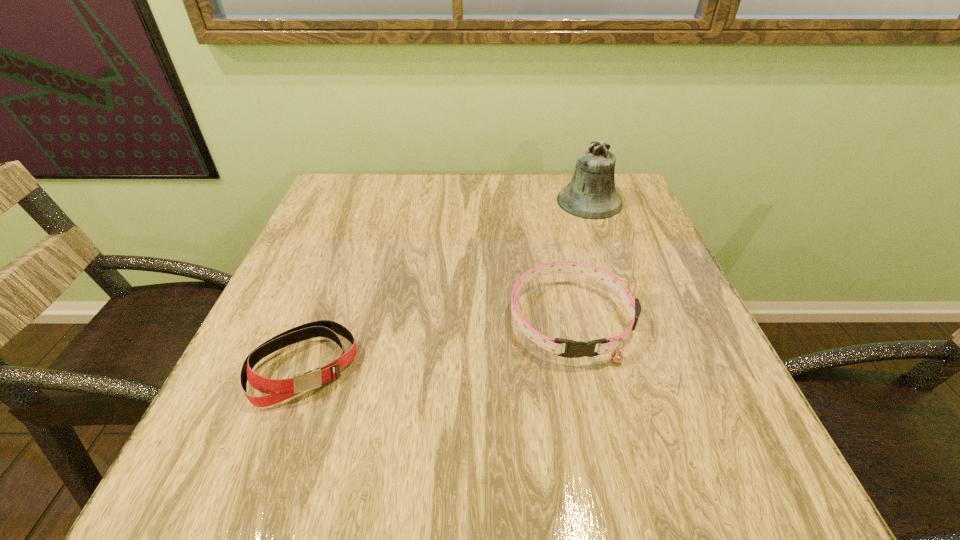
You are a GUI agent. You are given a task and a screenshot of the screen. Output one action in this format:
    pyautogui.click(x=<x>, y=<y>)
    Task: Click on the free space between the left dog collar and the right dog collar
    
    Given the screenshot: What is the action you would take?
    pyautogui.click(x=438, y=343)

The image size is (960, 540). I want to click on empty space between the bell and the right dog collar, so click(x=580, y=260).

Find the location of a particular element. This screenshot has width=960, height=540. vacant space in between the right dog collar and the bell is located at coordinates (580, 260).

Find the location of `free space that is in between the right dog collar and the leftmost object`. free space that is in between the right dog collar and the leftmost object is located at coordinates (438, 343).

Identify the location of free area in between the left dog collar and the right dog collar. The width and height of the screenshot is (960, 540). (438, 343).

Find the location of a particular element. This screenshot has height=540, width=960. free space between the tallest object and the right dog collar is located at coordinates (580, 260).

I want to click on empty space that is in between the leftmost object and the tallest object, so click(446, 284).

Image resolution: width=960 pixels, height=540 pixels. In order to click on free space between the leftmost object and the tallest object in this screenshot , I will do `click(446, 284)`.

Choose which object is the nearest neighbor to the right dog collar. Please provide its 2D coordinates. Your answer should be formatted as a tuple, i.e. [(x, y)], where the tuple contains the x and y coordinates of a point satisfying the conditions above.

[(591, 194)]

Identify which object is the second nearest to the farthest object. Please provide its 2D coordinates. Your answer should be formatted as a tuple, i.e. [(x, y)], where the tuple contains the x and y coordinates of a point satisfying the conditions above.

[(277, 390)]